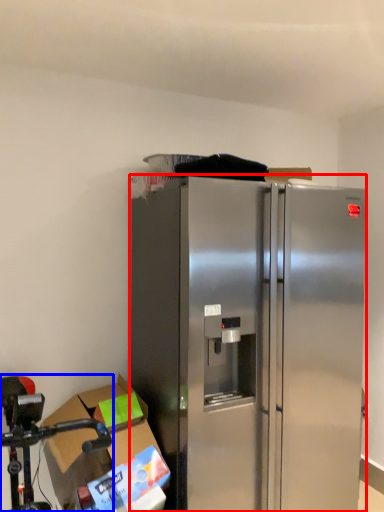
Question: Which point is further to the camera, refrigerator (highlighted by a red box) or stainless steel (highlighted by a blue box)?

Choices:
 (A) refrigerator
 (B) stainless steel

Answer: (A)